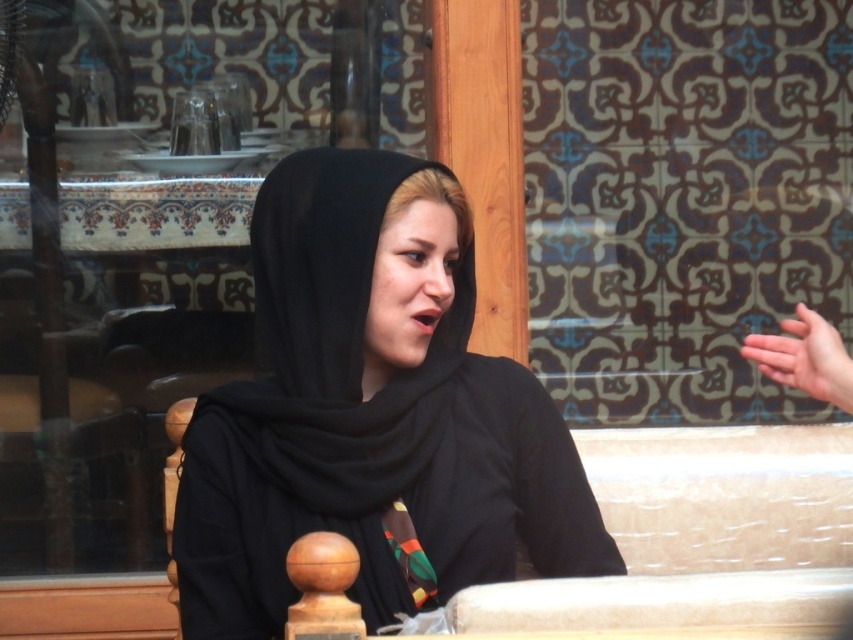
You are an artist trying to sketch this scene. You want to ensure the black matte headscarf at center and the smooth skin hand at right are positioned correctly. Based on the scene description, which object should be drawn lower on the page?

The black matte headscarf at center should be drawn lower on the page because it is positioned below the smooth skin hand at right.

You are a photographer trying to capture a closeup shot of the black matte headscarf at center and the smooth skin hand at right in the scene. The camera you are using has a maximum focus range of 24 inches. Will both objects be in focus at the same time?

The black matte headscarf at center and smooth skin hand at right are 24.63 inches apart from each other. Since the distance between them exceeds the camera maximum focus range of 24 inches, they cannot be both in focus at the same time.

You are an artist trying to sketch the scene. You need to decide the vertical positioning of the black matte headscarf at center and the smooth skin hand at right. Based on the image, which object should be drawn higher on the paper?

The black matte headscarf at center should be drawn higher on the paper because it is taller than the smooth skin hand at right.